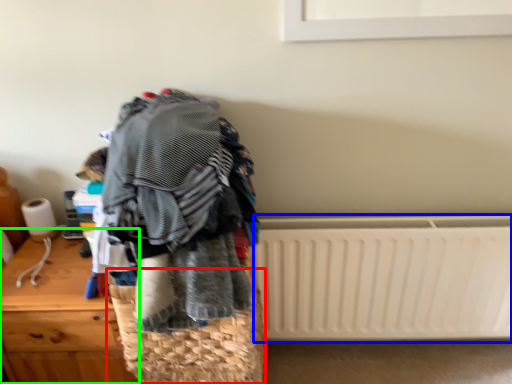
Question: Considering the real-world distances, which object is closest to basket (highlighted by a red box)? radiator (highlighted by a blue box) or furniture (highlighted by a green box).

Choices:
 (A) radiator
 (B) furniture

Answer: (B)